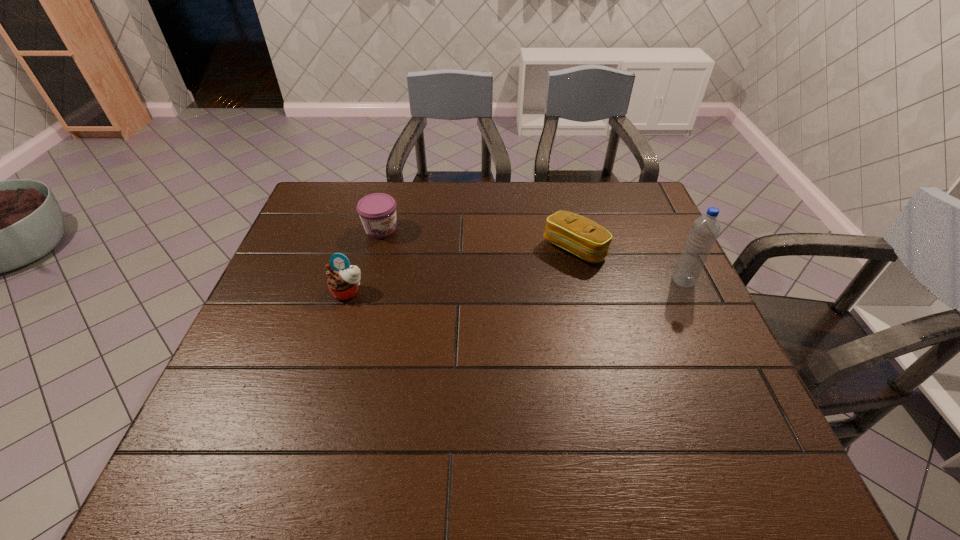
The height and width of the screenshot is (540, 960). Identify the location of free space located 0.310m on the zipper side of the clutch bag. (475, 321).

You are a GUI agent. You are given a task and a screenshot of the screen. Output one action in this format:
    pyautogui.click(x=<x>, y=<y>)
    Task: Click on the vacant region located on the zipper side of the clutch bag
    The image size is (960, 540).
    Given the screenshot: What is the action you would take?
    pyautogui.click(x=506, y=298)

This screenshot has width=960, height=540. I want to click on free space located on the zipper side of the clutch bag, so click(x=518, y=289).

I want to click on object that is at the far edge, so click(377, 211).

Image resolution: width=960 pixels, height=540 pixels. Find the location of `object positioned at the right edge`. object positioned at the right edge is located at coordinates (705, 229).

The height and width of the screenshot is (540, 960). What are the coordinates of `vacant space at the far edge of the desktop` in the screenshot? It's located at (467, 195).

In the image, there is a desktop. Identify the location of vacant space at the near edge. This screenshot has height=540, width=960. (658, 416).

Locate an element on the screen. The height and width of the screenshot is (540, 960). free space at the left edge of the desktop is located at coordinates (301, 238).

Identify the location of vacant space at the right edge of the desktop. The height and width of the screenshot is (540, 960). (660, 274).

Where is `free space at the far right corner`? free space at the far right corner is located at coordinates (642, 208).